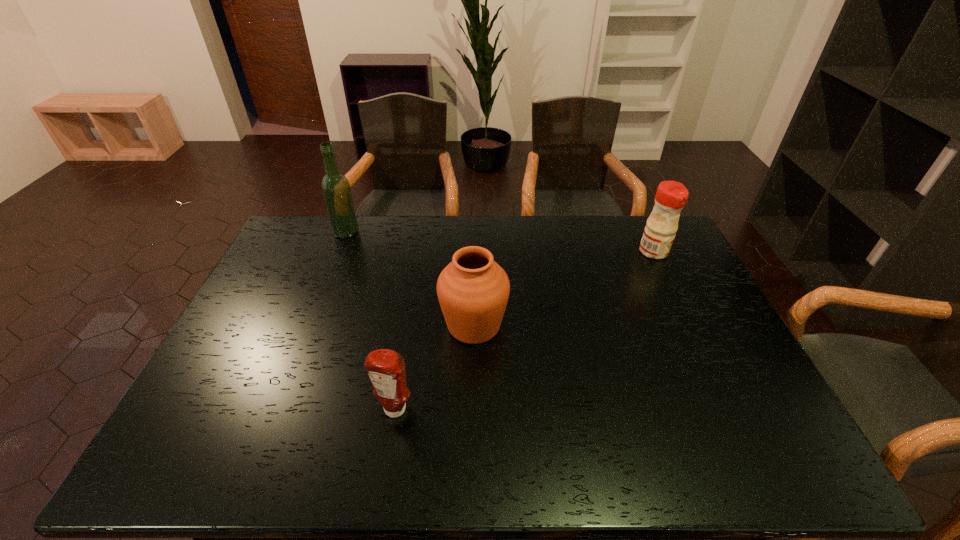
Locate an element on the screen. free spot between the left condiment and the tallest object is located at coordinates (371, 321).

The image size is (960, 540). Identify the location of unoccupied position between the urn and the tallest object. (410, 279).

Find the location of a particular element. This screenshot has height=540, width=960. vacant point located between the farthest object and the second nearest object is located at coordinates (410, 279).

The height and width of the screenshot is (540, 960). Identify the location of free space between the leftmost object and the third farthest object. (410, 279).

Locate an element on the screen. Image resolution: width=960 pixels, height=540 pixels. free space between the rightmost object and the shortest object is located at coordinates (524, 331).

Where is `vacant area that lies between the taller condiment and the second object from right to left`? Image resolution: width=960 pixels, height=540 pixels. vacant area that lies between the taller condiment and the second object from right to left is located at coordinates (564, 288).

Identify the location of vacant area that lies between the left condiment and the liquor. This screenshot has width=960, height=540. coord(371,321).

This screenshot has width=960, height=540. Find the location of `unoccupied area between the shortest object and the urn`. unoccupied area between the shortest object and the urn is located at coordinates 434,368.

Locate an element on the screen. This screenshot has height=540, width=960. vacant point located between the leftmost object and the second object from right to left is located at coordinates (410, 279).

I want to click on object identified as the third closest to the taller condiment, so click(336, 189).